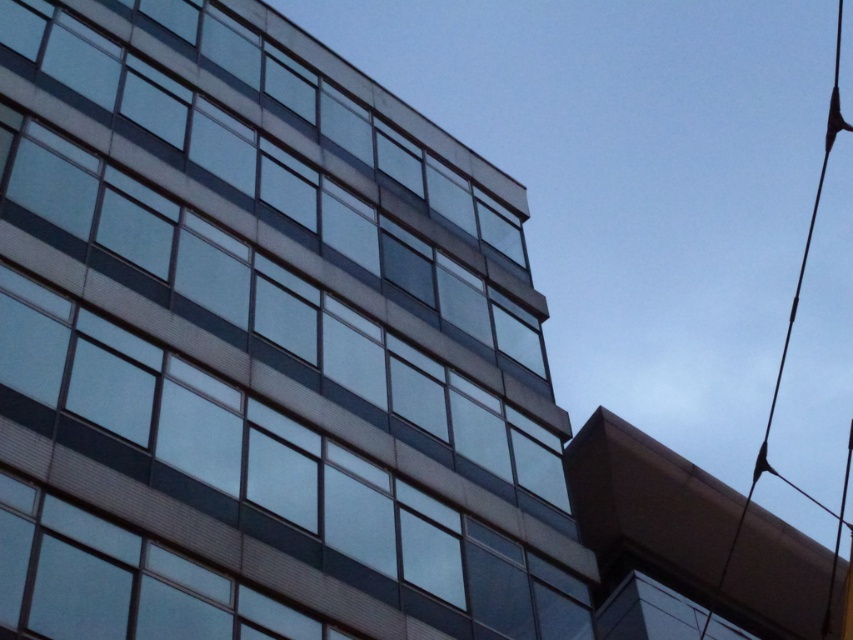
You are an architect reviewing the building design. You notice the transparent glass windows at center and the black wire at upper right. Based on their positions, which object is closer to the top of the building?

The black wire at upper right is closer to the top of the building because it is positioned above the transparent glass windows at center.

You are an architect analyzing the building facade. You notice the transparent glass windows at center and the black wire at upper right. Which object appears larger in the image?

The black wire at upper right appears larger than the transparent glass windows at center.

You are a drone operator who needs to deliver a package to the roof of the modern building. Your drone has a maximum flight distance of 35 meters. The black wire at upper right is near the roof edge. Can your drone safely reach the roof without exceeding its flight range if it starts from the transparent glass windows at center?

The transparent glass windows at center is 36.33 meters from the black wire at upper right. Since the drone can only fly 35 meters, it cannot safely reach the roof from the transparent glass windows at center without exceeding its flight range.